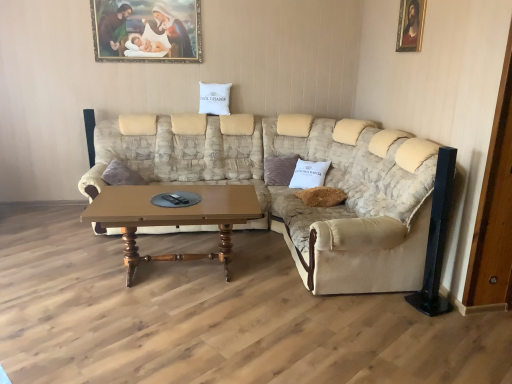
In order to click on wooden polished coffee table at center in this screenshot , I will do `click(173, 216)`.

The height and width of the screenshot is (384, 512). What do you see at coordinates (297, 190) in the screenshot?
I see `beige fabric couch at center` at bounding box center [297, 190].

From the picture: Measure the distance between beige fabric couch at center and camera.

beige fabric couch at center is 8.67 feet away from camera.

Find the location of `white fabric pillow at upper center, the first pillow positioned from the left`. white fabric pillow at upper center, the first pillow positioned from the left is located at coordinates (214, 98).

Image resolution: width=512 pixels, height=384 pixels. What do you see at coordinates (214, 98) in the screenshot?
I see `white fabric pillow at upper center, which is the first pillow in top-to-bottom order` at bounding box center [214, 98].

Image resolution: width=512 pixels, height=384 pixels. What do you see at coordinates (410, 25) in the screenshot? I see `wooden framed portrait at upper right, acting as the first picture frame starting from the front` at bounding box center [410, 25].

How much space does wooden framed portrait at upper right, the first picture frame positioned from the right, occupy vertically?

16.91 inches.

The width and height of the screenshot is (512, 384). In order to click on beige fabric couch at right in this screenshot , I will do `click(356, 204)`.

How different are the orientations of wooden polished coffee table at center and white fabric pillow at upper center, the first pillow positioned from the left, in degrees?

They differ by 13 degrees in their facing directions.

From a real-world perspective, which object rests below the other?

From a 3D spatial view, wooden polished coffee table at center is below.

Is wooden polished coffee table at center oriented towards white fabric pillow at upper center, positioned as the 2th pillow in right-to-left order?

No.

Between wooden polished coffee table at center and white fabric pillow at upper center, which is the first pillow in top-to-bottom order, which one has larger width?

wooden polished coffee table at center.

Looking at this image, who is bigger, white fabric pillow at upper center, the second pillow from the bottom, or wooden framed portrait at upper right, which ranks as the 2th picture frame in left-to-right order?

white fabric pillow at upper center, the second pillow from the bottom, is bigger.

Is point (200, 99) closer to viewer compared to point (414, 47)?

That is False.

Is wooden framed portrait at upper right, acting as the first picture frame starting from the front, at the back of white fabric pillow at upper center, which is the first pillow in top-to-bottom order?

white fabric pillow at upper center, which is the first pillow in top-to-bottom order, is not turned away from wooden framed portrait at upper right, acting as the first picture frame starting from the front.

Is white fabric pillow at upper center, the first pillow positioned from the left, inside the boundaries of wooden framed portrait at upper right, positioned as the 2th picture frame in back-to-front order, or outside?

The correct answer is: outside.

How many degrees apart are the facing directions of white fabric pillow at upper center, positioned as the 2th pillow in right-to-left order, and beige fabric couch at right?

The angular difference between white fabric pillow at upper center, positioned as the 2th pillow in right-to-left order, and beige fabric couch at right is 75.2 degrees.

Is white fabric pillow at upper center, which is the first pillow in top-to-bottom order, not inside beige fabric couch at right?

Yes, white fabric pillow at upper center, which is the first pillow in top-to-bottom order, is located beyond the bounds of beige fabric couch at right.

From the image's perspective, is white fabric pillow at upper center, positioned as the 2th pillow in right-to-left order, located above or below beige fabric couch at right?

white fabric pillow at upper center, positioned as the 2th pillow in right-to-left order, is situated higher than beige fabric couch at right in the image.

Is point (218, 100) farther from camera compared to point (388, 229)?

Yes, it is.

From a real-world perspective, is wooden framed painting at upper center, which is counted as the first picture frame, starting from the left, positioned over wooden polished coffee table at center based on gravity?

Yes, from a real-world perspective, wooden framed painting at upper center, which is counted as the first picture frame, starting from the left, is over wooden polished coffee table at center

From the image's perspective, is wooden framed painting at upper center, which is the 1th picture frame from back to front, located beneath wooden polished coffee table at center?

No, from the image's perspective, wooden framed painting at upper center, which is the 1th picture frame from back to front, is not below wooden polished coffee table at center.

Is wooden framed painting at upper center, placed as the 2th picture frame when sorted from front to back, beside wooden polished coffee table at center?

No, wooden framed painting at upper center, placed as the 2th picture frame when sorted from front to back, is not making contact with wooden polished coffee table at center.

Measure the distance from wooden framed painting at upper center, marked as the second picture frame in a right-to-left arrangement, to wooden polished coffee table at center.

They are 6.60 feet apart.

Which object is positioned more to the left, beige fabric couch at center or white fabric pillow at upper center, the second pillow from the bottom?

white fabric pillow at upper center, the second pillow from the bottom.

Would you say beige fabric couch at center contains white fabric pillow at upper center, the first pillow positioned from the left?

Definitely not — white fabric pillow at upper center, the first pillow positioned from the left, is not inside beige fabric couch at center.

Is beige fabric couch at center bigger than white fabric pillow at upper center, the second pillow from the bottom?

Indeed, beige fabric couch at center has a larger size compared to white fabric pillow at upper center, the second pillow from the bottom.

Does beige fabric couch at center turn towards white fabric pillow at upper center, the second pillow from the bottom?

No.

Are wooden framed portrait at upper right, positioned as the 2th picture frame in back-to-front order, and wooden polished coffee table at center beside each other?

wooden framed portrait at upper right, positioned as the 2th picture frame in back-to-front order, and wooden polished coffee table at center are not in contact.

Is wooden framed portrait at upper right, acting as the first picture frame starting from the front, oriented towards wooden polished coffee table at center?

No.

Is wooden framed portrait at upper right, positioned as the 2th picture frame in back-to-front order, in front of or behind wooden polished coffee table at center in the image?

Visually, wooden framed portrait at upper right, positioned as the 2th picture frame in back-to-front order, is located behind wooden polished coffee table at center.

From the image's perspective, relative to wooden polished coffee table at center, is wooden framed portrait at upper right, acting as the first picture frame starting from the front, above or below?

Based on their image positions, wooden framed portrait at upper right, acting as the first picture frame starting from the front, is located above wooden polished coffee table at center.

Is beige fabric couch at center aimed at wooden framed portrait at upper right, the first picture frame positioned from the right?

No, beige fabric couch at center is not aimed at wooden framed portrait at upper right, the first picture frame positioned from the right.

Considering the relative sizes of beige fabric couch at center and wooden framed portrait at upper right, the first picture frame positioned from the right, in the image provided, is beige fabric couch at center taller than wooden framed portrait at upper right, the first picture frame positioned from the right,?

Indeed, beige fabric couch at center has a greater height compared to wooden framed portrait at upper right, the first picture frame positioned from the right.

Can you confirm if beige fabric couch at center is smaller than wooden framed portrait at upper right, acting as the first picture frame starting from the front?

Incorrect, beige fabric couch at center is not smaller in size than wooden framed portrait at upper right, acting as the first picture frame starting from the front.

Which is more distant, (173, 173) or (419, 23)?

The point (173, 173) is behind.

There is a wooden polished coffee table at center. Identify the location of the 2nd pillow above it (from the image's perspective). (214, 98).

From a real-world perspective, starting from the wooden framed portrait at upper right, positioned as the 2th picture frame in back-to-front order, which pillow is the 1st one below it? Please provide its 2D coordinates.

[(214, 98)]

Based on their spatial positions, is beige fabric couch at right or wooden polished coffee table at center closer to wooden framed painting at upper center, which is counted as the first picture frame, starting from the left?

beige fabric couch at right.

Which object lies nearer to the anchor point wooden polished coffee table at center, beige fabric couch at right or white fabric pillow at upper center, positioned as the 2th pillow in right-to-left order?

Based on the image, beige fabric couch at right appears to be nearer to wooden polished coffee table at center.

Estimate the real-world distances between objects in this image. Which object is further from wooden framed painting at upper center, placed as the 2th picture frame when sorted from front to back, wooden polished coffee table at center or beige fabric couch at center?

wooden polished coffee table at center is further to wooden framed painting at upper center, placed as the 2th picture frame when sorted from front to back.

Estimate the real-world distances between objects in this image. Which object is closer to wooden polished coffee table at center, velvet brown pillow at center, positioned as the second pillow in top-to-bottom order, or beige fabric couch at center?

beige fabric couch at center is positioned closer to the anchor wooden polished coffee table at center.

Based on their spatial positions, is wooden polished coffee table at center or velvet brown pillow at center, the 1th pillow positioned from the right, further from beige fabric couch at center?

The object further to beige fabric couch at center is wooden polished coffee table at center.

Based on their spatial positions, is beige fabric couch at center or wooden polished coffee table at center closer to white fabric pillow at upper center, the second pillow from the bottom?

Based on the image, beige fabric couch at center appears to be nearer to white fabric pillow at upper center, the second pillow from the bottom.

Estimate the real-world distances between objects in this image. Which object is further from wooden polished coffee table at center, beige fabric couch at center or beige fabric couch at right?

beige fabric couch at right is positioned further to the anchor wooden polished coffee table at center.

Which object lies nearer to the anchor point white fabric pillow at upper center, the second pillow from the bottom, wooden framed painting at upper center, placed as the 2th picture frame when sorted from front to back, or wooden polished coffee table at center?

The object closer to white fabric pillow at upper center, the second pillow from the bottom, is wooden framed painting at upper center, placed as the 2th picture frame when sorted from front to back.

This screenshot has height=384, width=512. Find the location of `couch between beige fabric couch at center and white fabric pillow at upper center, which is the first pillow in top-to-bottom order, along the z-axis`. couch between beige fabric couch at center and white fabric pillow at upper center, which is the first pillow in top-to-bottom order, along the z-axis is located at coordinates (356, 204).

Find the location of a particular element. pillow that lies between wooden framed painting at upper center, marked as the second picture frame in a right-to-left arrangement, and velvet brown pillow at center, positioned as the second pillow in top-to-bottom order, from top to bottom is located at coordinates (214, 98).

Locate an element on the screen. This screenshot has width=512, height=384. pillow between wooden polished coffee table at center and white fabric pillow at upper center, the second pillow from the bottom, in the front-back direction is located at coordinates (279, 169).

Image resolution: width=512 pixels, height=384 pixels. I want to click on studio couch between wooden framed painting at upper center, which is counted as the first picture frame, starting from the left, and wooden framed portrait at upper right, which ranks as the 2th picture frame in left-to-right order, in the horizontal direction, so click(x=297, y=190).